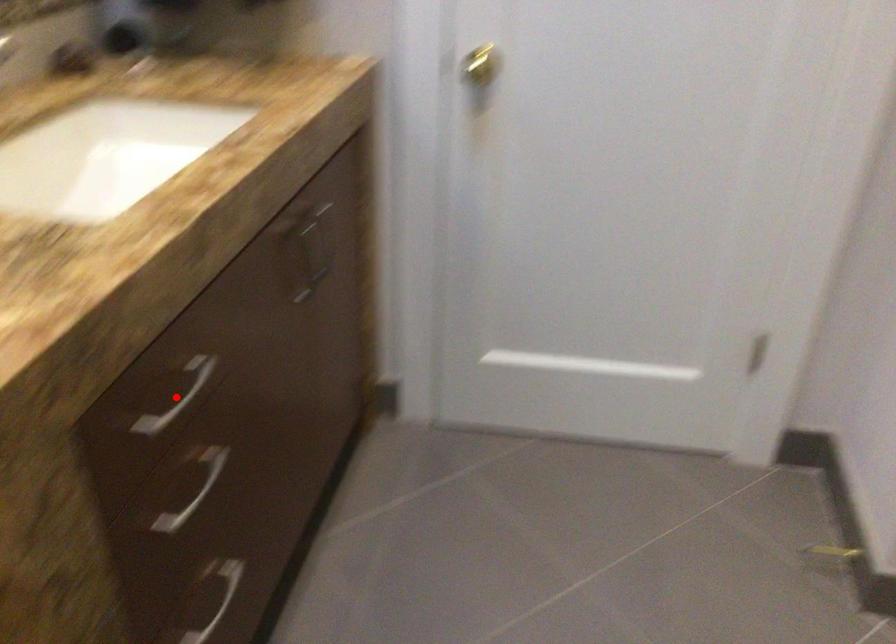
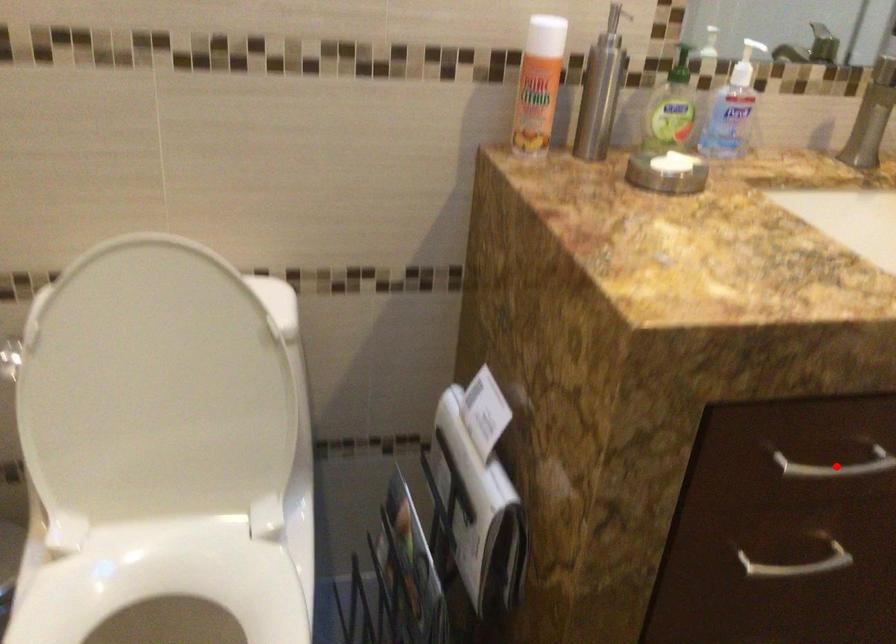
I am providing you with two images of the same scene from different viewpoints. A red point is marked on the first image and another point is marked on the second image. Do the highlighted points in image1 and image2 indicate the same real-world spot?

Yes